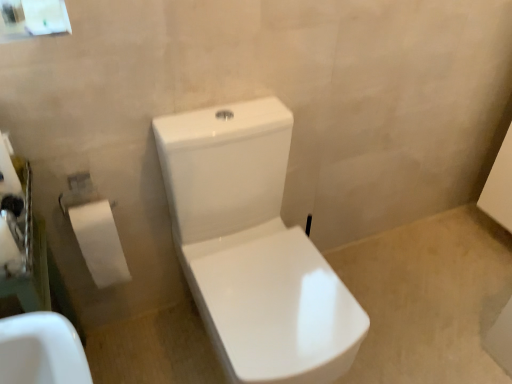
Question: Is white paper at left wider than white glossy toilet at center?

Choices:
 (A) no
 (B) yes

Answer: (A)

Question: From a real-world perspective, is white paper at left beneath white glossy toilet at center?

Choices:
 (A) yes
 (B) no

Answer: (B)

Question: Can you confirm if white paper at left is shorter than white glossy toilet at center?

Choices:
 (A) no
 (B) yes

Answer: (B)

Question: Is white paper at left smaller than white glossy toilet at center?

Choices:
 (A) no
 (B) yes

Answer: (B)

Question: Considering the relative sizes of white paper at left and white glossy toilet at center in the image provided, is white paper at left thinner than white glossy toilet at center?

Choices:
 (A) yes
 (B) no

Answer: (A)

Question: Does white paper at left have a greater height compared to white glossy toilet at center?

Choices:
 (A) no
 (B) yes

Answer: (A)

Question: From a real-world perspective, is white paper at left beneath white paper at left?

Choices:
 (A) no
 (B) yes

Answer: (B)

Question: Is white paper at left closer to the viewer compared to white paper at left?

Choices:
 (A) yes
 (B) no

Answer: (B)

Question: Is white paper at left in contact with white paper at left?

Choices:
 (A) yes
 (B) no

Answer: (B)

Question: Is white paper at left facing towards white paper at left?

Choices:
 (A) yes
 (B) no

Answer: (B)

Question: Is white paper at left facing away from white paper at left?

Choices:
 (A) yes
 (B) no

Answer: (B)

Question: Is white paper at left not inside white paper at left?

Choices:
 (A) no
 (B) yes

Answer: (B)

Question: From the image's perspective, is white paper at left located above white paper at left?

Choices:
 (A) no
 (B) yes

Answer: (B)